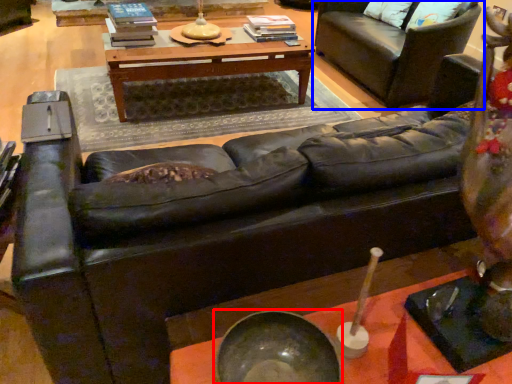
Question: Which of the following is the farthest to the observer, bowl (highlighted by a red box) or studio couch (highlighted by a blue box)?

Choices:
 (A) bowl
 (B) studio couch

Answer: (B)